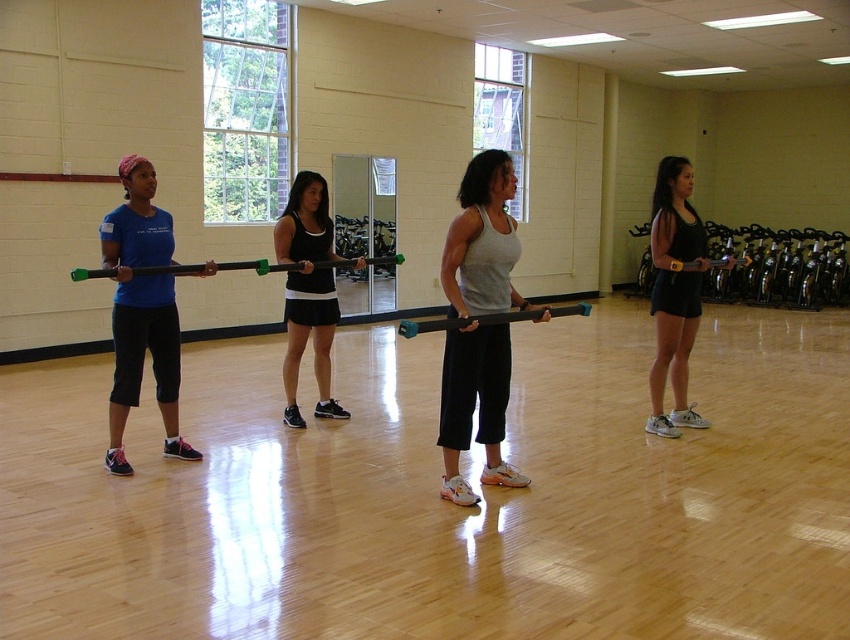
You are a photographer setting up for a group photo. You need to arrange the participants so that the matte blue shirt at left and the black matte tank top at center are both visible in the frame. Considering their sizes, which one should be placed closer to the camera to ensure both are fully visible?

The matte blue shirt at left is smaller than the black matte tank top at center. To ensure both are fully visible, the smaller matte blue shirt at left should be placed closer to the camera so that its size appears comparable to the larger black matte tank top at center in the photo.

You are a fitness instructor observing the class. You notice two participants wearing different colored shirts. Which participant is closer to you, the one in the gray matte tank top at center or the one in the matte blue shirt at left?

The gray matte tank top at center is closer to you because it is positioned in front of the matte blue shirt at left.

You are standing at the entrance of the gymnasium and want to reach the point marked at coordinates point (508, 372). If your walking speed is 3 feet per second, how many seconds will it take you to reach that point?

The distance of point (508, 372) from camera is 16.66 feet. At a speed of 3 feet per second, it will take approximately 5.55 seconds to reach the point.